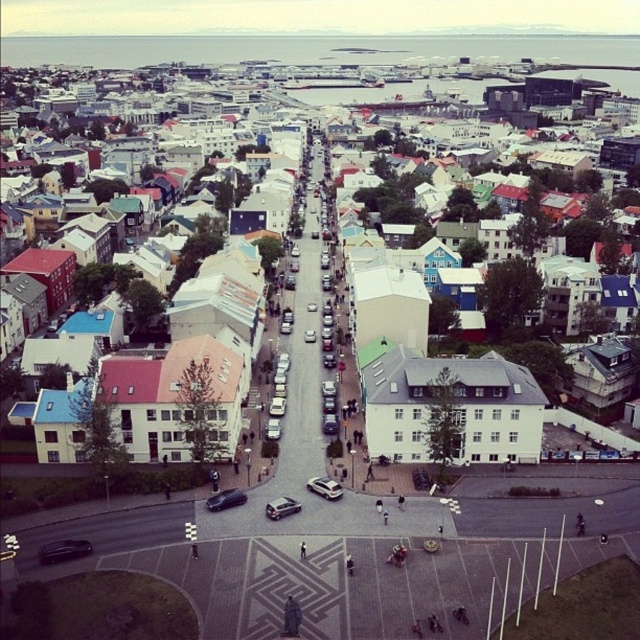
You are standing at the center of the street in this European city scene. There are two points marked in the image, one at coordinate point (61, 561) and another at point (275, 515). Which point is closer to your current position?

Point (61, 561) is closer to the viewer than point (275, 515), so the point at (61, 561) is closer to your current position.

You are a delivery drone flying above the city. You need to land on the shiny black car at center, but there is a white matte building at center in your way. Can you safely land on the car without hitting the building?

The shiny black car at center is behind the white matte building at center, so you cannot safely land on the car without first navigating around or over the building.

Based on the photo, you are a delivery person trying to park your van, which is 2 meters wide, in the space between the shiny black car at center and the silver metallic hatchback at center. Can your van fit in that space?

The shiny black car at center is thinner than the silver metallic hatchback at center, but the description does not provide the exact width of the space between them. Therefore, it is unclear if the van can fit.